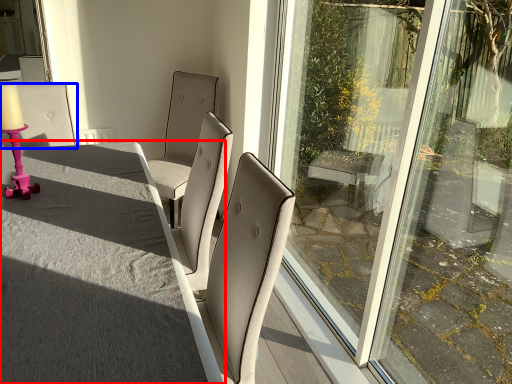
Question: Which point is closer to the camera, table (highlighted by a red box) or chair (highlighted by a blue box)?

Choices:
 (A) table
 (B) chair

Answer: (A)